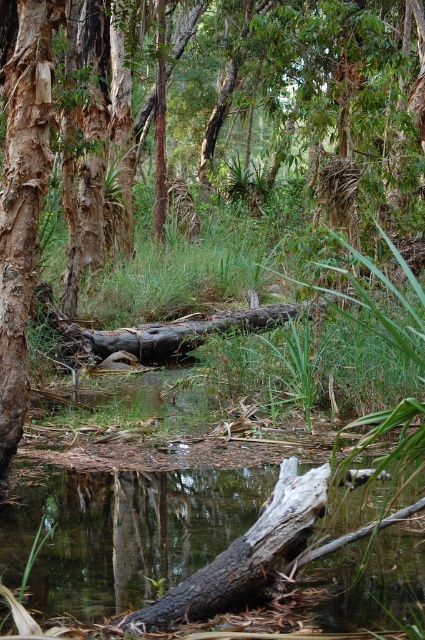
Question: Which of these objects is positioned closest to the brown rough log at center?

Choices:
 (A) smooth bark tree trunk at left
 (B) transparent water at center

Answer: (B)

Question: Does transparent water at center come behind brown rough log at center?

Choices:
 (A) yes
 (B) no

Answer: (B)

Question: Is transparent water at center smaller than smooth bark tree trunk at left?

Choices:
 (A) yes
 (B) no

Answer: (B)

Question: Among these objects, which one is nearest to the camera?

Choices:
 (A) brown rough log at center
 (B) transparent water at center
 (C) smooth bark tree trunk at left

Answer: (B)

Question: Which object is the closest to the brown rough log at center?

Choices:
 (A) smooth bark tree trunk at left
 (B) transparent water at center

Answer: (B)

Question: Is the position of transparent water at center more distant than that of smooth bark tree trunk at left?

Choices:
 (A) no
 (B) yes

Answer: (A)